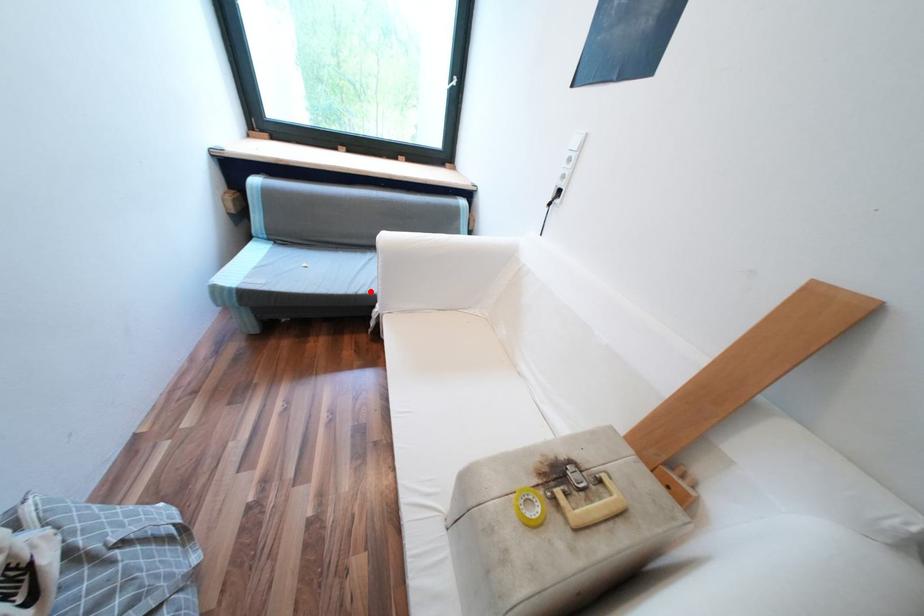
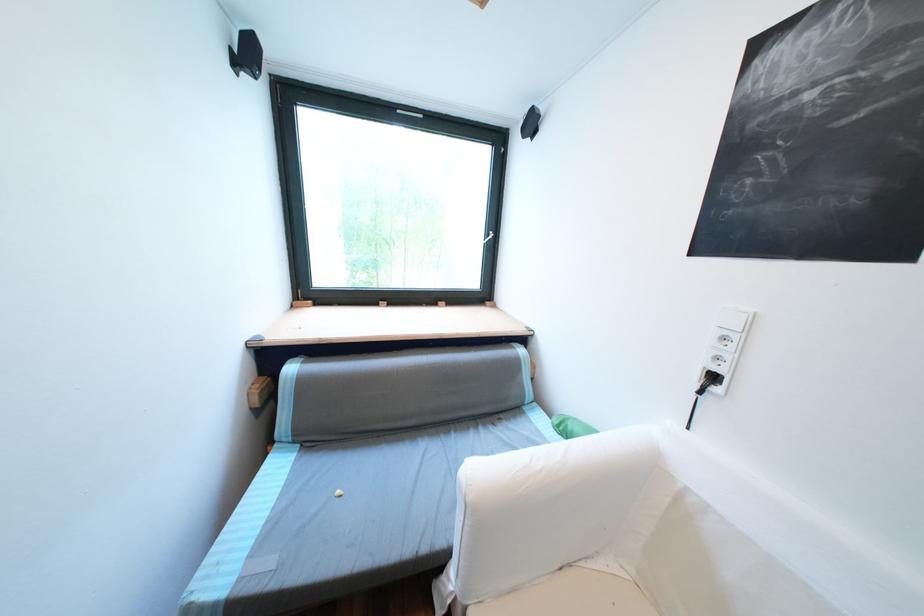
Find the pixel in the second image that matches the highlighted location in the first image.

(433, 549)